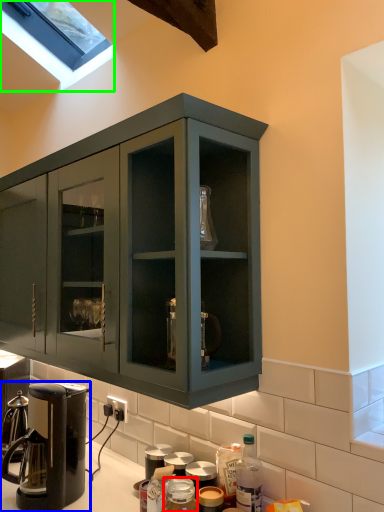
Question: Which is farther away from bottle (highlighted by a red box)? coffee maker (highlighted by a blue box) or window (highlighted by a green box)?

Choices:
 (A) coffee maker
 (B) window

Answer: (B)